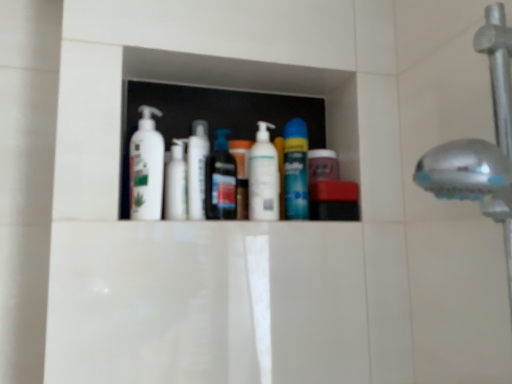
This screenshot has width=512, height=384. Identify the location of white glossy pump bottle at center, the first toiletry from the right. (241, 174).

In order to face white glossy lotion at center, placed as the third toiletry when sorted from right to left, should I rotate leftwards or rightwards?

Rotate your view left by about 10.604°.

Image resolution: width=512 pixels, height=384 pixels. What do you see at coordinates (296, 170) in the screenshot?
I see `blue glossy can at center, which ranks as the 2th mouthwash in left-to-right order` at bounding box center [296, 170].

The image size is (512, 384). Describe the element at coordinates (146, 167) in the screenshot. I see `white matte lotion at center, the second cleaning product positioned from the right` at that location.

The width and height of the screenshot is (512, 384). What are the coordinates of `white glossy pump bottle at center, the 1th cleaning product in the right-to-left sequence` in the screenshot? It's located at (x=263, y=176).

Describe the element at coordinates (197, 169) in the screenshot. I see `white glossy lotion at center, acting as the 2th toiletry starting from the right` at that location.

Identify the location of translucent plastic mouthwash at center, the second mouthwash positioned from the right. (221, 180).

Locate an element on the screen. The height and width of the screenshot is (384, 512). white glossy pump bottle at center, positioned as the third toiletry in left-to-right order is located at coordinates (241, 174).

Can you confirm if white matte lotion at center, positioned as the first cleaning product in left-to-right order, is positioned to the left of white glossy lotion at center, placed as the third toiletry when sorted from right to left?

Indeed, white matte lotion at center, positioned as the first cleaning product in left-to-right order, is positioned on the left side of white glossy lotion at center, placed as the third toiletry when sorted from right to left.

From the image's perspective, is white matte lotion at center, positioned as the first cleaning product in left-to-right order, on top of white glossy lotion at center, which ranks as the first toiletry in left-to-right order?

Yes.

Between white matte lotion at center, the second cleaning product positioned from the right, and white glossy lotion at center, which ranks as the first toiletry in left-to-right order, which one has less height?

white glossy lotion at center, which ranks as the first toiletry in left-to-right order, is shorter.

There is a white glossy lotion at center, acting as the 2th toiletry starting from the right. Find the location of `the 2nd cleaning product above it (from the image's perspective)`. the 2nd cleaning product above it (from the image's perspective) is located at coordinates (146, 167).

Is white glossy lotion at center, placed as the second toiletry when sorted from left to right, aimed at white matte lotion at center, the second cleaning product positioned from the right?

No, white glossy lotion at center, placed as the second toiletry when sorted from left to right, is not aimed at white matte lotion at center, the second cleaning product positioned from the right.

Does white glossy lotion at center, acting as the 2th toiletry starting from the right, have a larger size compared to white matte lotion at center, the second cleaning product positioned from the right?

No.

From the image's perspective, relative to white matte lotion at center, the second cleaning product positioned from the right, is white glossy lotion at center, placed as the second toiletry when sorted from left to right, above or below?

From the image's perspective, white glossy lotion at center, placed as the second toiletry when sorted from left to right, appears below white matte lotion at center, the second cleaning product positioned from the right.

Would you say white glossy pump bottle at center, the 2th cleaning product positioned from the left, is part of white glossy lotion at center, placed as the third toiletry when sorted from right to left,'s contents?

That's incorrect, white glossy pump bottle at center, the 2th cleaning product positioned from the left, is not inside white glossy lotion at center, placed as the third toiletry when sorted from right to left.

Is white glossy lotion at center, placed as the third toiletry when sorted from right to left, directly adjacent to white glossy pump bottle at center, the 1th cleaning product in the right-to-left sequence?

white glossy lotion at center, placed as the third toiletry when sorted from right to left, and white glossy pump bottle at center, the 1th cleaning product in the right-to-left sequence, are clearly separated.

From a real-world perspective, relative to white glossy pump bottle at center, the 1th cleaning product in the right-to-left sequence, is white glossy lotion at center, placed as the third toiletry when sorted from right to left, vertically above or below?

white glossy lotion at center, placed as the third toiletry when sorted from right to left, is situated lower than white glossy pump bottle at center, the 1th cleaning product in the right-to-left sequence, in the real world.

Does translucent plastic mouthwash at center, the second mouthwash positioned from the right, have a lesser width compared to blue glossy can at center, which ranks as the 2th mouthwash in left-to-right order?

Yes.

Does translucent plastic mouthwash at center, the second mouthwash positioned from the right, appear on the left side of blue glossy can at center, which is the 1th mouthwash in right-to-left order?

Yes.

Based on the photo, from a real-world perspective, is translucent plastic mouthwash at center, the second mouthwash positioned from the right, located beneath blue glossy can at center, which ranks as the 2th mouthwash in left-to-right order?

Indeed, from a real-world perspective, translucent plastic mouthwash at center, the second mouthwash positioned from the right, is positioned beneath blue glossy can at center, which ranks as the 2th mouthwash in left-to-right order.

You are a GUI agent. You are given a task and a screenshot of the screen. Output one action in this format:
    pyautogui.click(x=<x>, y=<y>)
    Task: Click on the mouthwash above the translucent plastic mouthwash at center, the second mouthwash positioned from the right (from a real-world perspective)
    Image resolution: width=512 pixels, height=384 pixels.
    Given the screenshot: What is the action you would take?
    pyautogui.click(x=296, y=170)

Considering the relative sizes of white glossy lotion at center, placed as the second toiletry when sorted from left to right, and blue glossy can at center, which ranks as the 2th mouthwash in left-to-right order, in the image provided, is white glossy lotion at center, placed as the second toiletry when sorted from left to right, wider than blue glossy can at center, which ranks as the 2th mouthwash in left-to-right order,?

No.

Which object is more forward, white glossy lotion at center, acting as the 2th toiletry starting from the right, or blue glossy can at center, which ranks as the 2th mouthwash in left-to-right order?

white glossy lotion at center, acting as the 2th toiletry starting from the right, is closer to the camera.

From a real-world perspective, which is physically below, white glossy lotion at center, placed as the second toiletry when sorted from left to right, or blue glossy can at center, which is the 1th mouthwash in right-to-left order?

white glossy lotion at center, placed as the second toiletry when sorted from left to right.

From the image's perspective, is white glossy lotion at center, placed as the second toiletry when sorted from left to right, positioned above or below blue glossy can at center, which is the 1th mouthwash in right-to-left order?

white glossy lotion at center, placed as the second toiletry when sorted from left to right, is below blue glossy can at center, which is the 1th mouthwash in right-to-left order.

Considering the sizes of objects white glossy pump bottle at center, the first toiletry from the right, and white glossy lotion at center, which ranks as the first toiletry in left-to-right order, in the image provided, who is thinner, white glossy pump bottle at center, the first toiletry from the right, or white glossy lotion at center, which ranks as the first toiletry in left-to-right order,?

white glossy pump bottle at center, the first toiletry from the right.

From the picture: From the image's perspective, between white glossy pump bottle at center, positioned as the third toiletry in left-to-right order, and white glossy lotion at center, placed as the third toiletry when sorted from right to left, which one is located above?

white glossy lotion at center, placed as the third toiletry when sorted from right to left, is shown above in the image.

Is white glossy pump bottle at center, positioned as the third toiletry in left-to-right order, in contact with white glossy lotion at center, which ranks as the first toiletry in left-to-right order?

No, white glossy pump bottle at center, positioned as the third toiletry in left-to-right order, is not touching white glossy lotion at center, which ranks as the first toiletry in left-to-right order.

In terms of size, does translucent plastic mouthwash at center, placed as the 1th mouthwash when sorted from left to right, appear bigger or smaller than white matte lotion at center, positioned as the first cleaning product in left-to-right order?

Clearly, translucent plastic mouthwash at center, placed as the 1th mouthwash when sorted from left to right, is smaller in size than white matte lotion at center, positioned as the first cleaning product in left-to-right order.

From a real-world perspective, relative to white matte lotion at center, the second cleaning product positioned from the right, is translucent plastic mouthwash at center, placed as the 1th mouthwash when sorted from left to right, vertically above or below?

Answer: Clearly, from a real-world perspective, translucent plastic mouthwash at center, placed as the 1th mouthwash when sorted from left to right, is below white matte lotion at center, the second cleaning product positioned from the right.

Which of these two, translucent plastic mouthwash at center, placed as the 1th mouthwash when sorted from left to right, or white matte lotion at center, the second cleaning product positioned from the right, stands taller?

Standing taller between the two is white matte lotion at center, the second cleaning product positioned from the right.

I want to click on the 2nd cleaning product directly above the translucent plastic mouthwash at center, placed as the 1th mouthwash when sorted from left to right (from a real-world perspective), so click(146, 167).

Starting from the white matte lotion at center, the second cleaning product positioned from the right, which toiletry is the 2nd one behind? Please provide its 2D coordinates.

[(175, 183)]

Where is `the 1st toiletry below the white matte lotion at center, positioned as the first cleaning product in left-to-right order (from the image's perspective)`? the 1st toiletry below the white matte lotion at center, positioned as the first cleaning product in left-to-right order (from the image's perspective) is located at coordinates (197, 169).

Consider the image. Based on their spatial positions, is blue glossy can at center, which ranks as the 2th mouthwash in left-to-right order, or white matte lotion at center, the second cleaning product positioned from the right, closer to white glossy pump bottle at center, the 1th cleaning product in the right-to-left sequence?

blue glossy can at center, which ranks as the 2th mouthwash in left-to-right order, lies closer to white glossy pump bottle at center, the 1th cleaning product in the right-to-left sequence, than the other object.

Looking at this image, looking at the image, which one is located further to white glossy lotion at center, placed as the second toiletry when sorted from left to right, translucent plastic mouthwash at center, placed as the 1th mouthwash when sorted from left to right, or white matte lotion at center, the second cleaning product positioned from the right?

white matte lotion at center, the second cleaning product positioned from the right, is further to white glossy lotion at center, placed as the second toiletry when sorted from left to right.

When comparing their distances from white glossy pump bottle at center, the 2th cleaning product positioned from the left, does white glossy lotion at center, which ranks as the first toiletry in left-to-right order, or white matte lotion at center, positioned as the first cleaning product in left-to-right order, seem further?

white matte lotion at center, positioned as the first cleaning product in left-to-right order.

Considering their positions, is white glossy pump bottle at center, positioned as the third toiletry in left-to-right order, positioned closer to white glossy lotion at center, placed as the third toiletry when sorted from right to left, than blue glossy can at center, which is the 1th mouthwash in right-to-left order?

white glossy pump bottle at center, positioned as the third toiletry in left-to-right order.

Looking at the image, which one is located further to white glossy pump bottle at center, the 1th cleaning product in the right-to-left sequence, white glossy pump bottle at center, positioned as the third toiletry in left-to-right order, or white matte lotion at center, positioned as the first cleaning product in left-to-right order?

white matte lotion at center, positioned as the first cleaning product in left-to-right order.

When comparing their distances from white matte lotion at center, positioned as the first cleaning product in left-to-right order, does white glossy pump bottle at center, the first toiletry from the right, or white glossy pump bottle at center, the 1th cleaning product in the right-to-left sequence, seem further?

white glossy pump bottle at center, the 1th cleaning product in the right-to-left sequence.

Which object lies further to the anchor point white glossy lotion at center, placed as the second toiletry when sorted from left to right, translucent plastic mouthwash at center, placed as the 1th mouthwash when sorted from left to right, or white glossy lotion at center, which ranks as the first toiletry in left-to-right order?

The object further to white glossy lotion at center, placed as the second toiletry when sorted from left to right, is white glossy lotion at center, which ranks as the first toiletry in left-to-right order.

Based on the photo, looking at the image, which one is located further to white glossy pump bottle at center, the 2th cleaning product positioned from the left, white glossy lotion at center, acting as the 2th toiletry starting from the right, or translucent plastic mouthwash at center, placed as the 1th mouthwash when sorted from left to right?

white glossy lotion at center, acting as the 2th toiletry starting from the right, is further to white glossy pump bottle at center, the 2th cleaning product positioned from the left.

I want to click on mouthwash between white matte lotion at center, positioned as the first cleaning product in left-to-right order, and white glossy pump bottle at center, the 2th cleaning product positioned from the left, in the horizontal direction, so click(x=221, y=180).

Locate an element on the screen. mouthwash between white glossy lotion at center, placed as the third toiletry when sorted from right to left, and white glossy pump bottle at center, positioned as the third toiletry in left-to-right order is located at coordinates (221, 180).

The width and height of the screenshot is (512, 384). I want to click on toiletry located between white glossy lotion at center, which ranks as the first toiletry in left-to-right order, and white glossy pump bottle at center, the first toiletry from the right, in the left-right direction, so click(x=197, y=169).

At what (x,y) coordinates should I click in order to perform the action: click on cleaning product located between white glossy lotion at center, placed as the second toiletry when sorted from left to right, and blue glossy can at center, which ranks as the 2th mouthwash in left-to-right order, in the left-right direction. Please return your answer as a coordinate pair (x, y). Looking at the image, I should click on (263, 176).